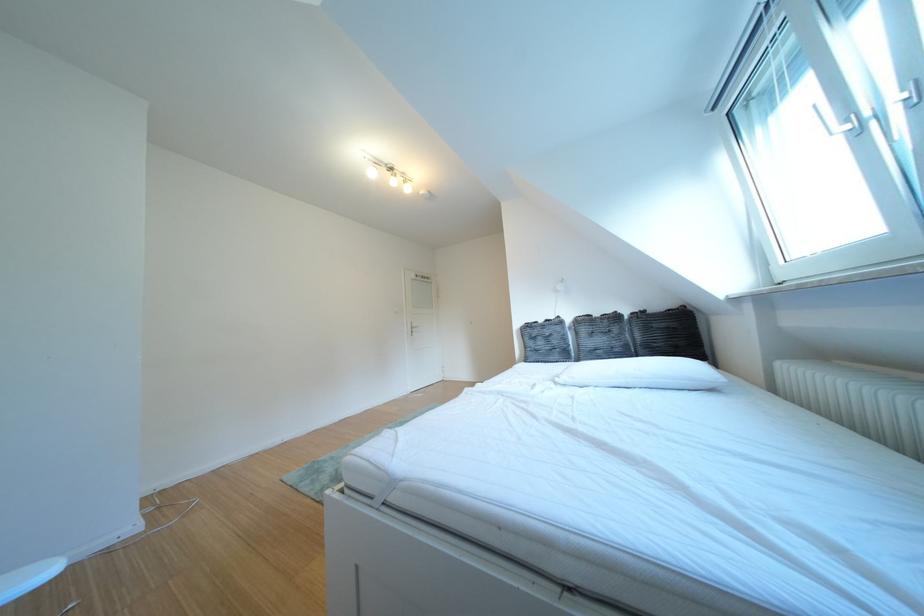
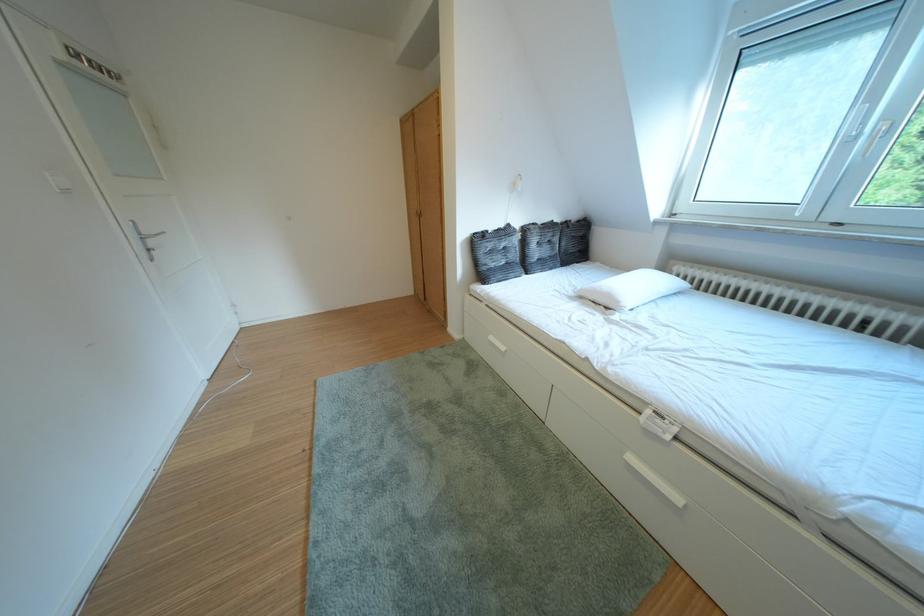
Locate, in the second image, the point that corresponds to [573,323] in the first image.

(523, 230)